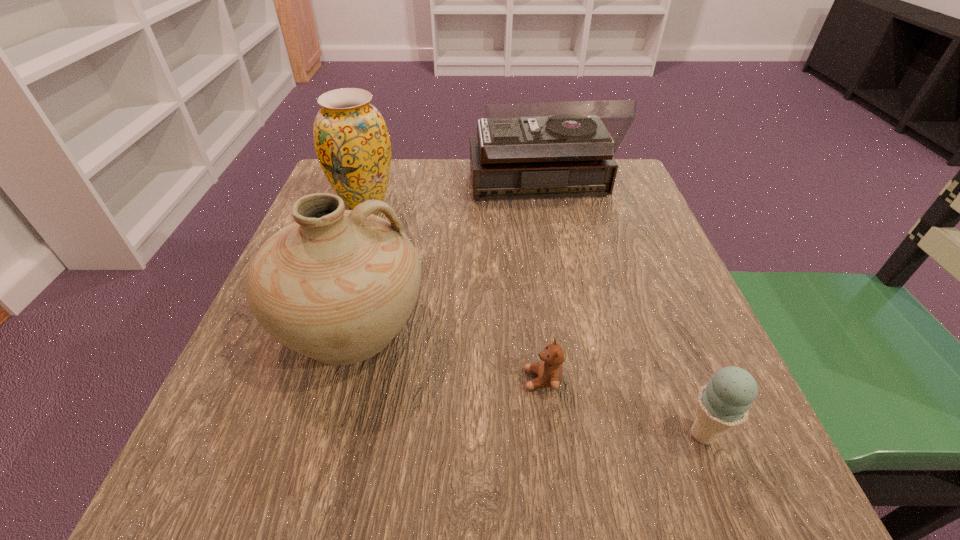
Find the location of `record player`. record player is located at coordinates (531, 149).

At what (x,y) coordinates should I click in order to perform the action: click on pottery. Please return your answer as a coordinate pair (x, y). The image size is (960, 540). Looking at the image, I should click on (336, 285).

At what (x,y) coordinates should I click in order to perform the action: click on vase. Please return your answer as a coordinate pair (x, y). This screenshot has width=960, height=540. Looking at the image, I should click on (351, 140).

Locate an element on the screen. The width and height of the screenshot is (960, 540). the fourth tallest object is located at coordinates (724, 403).

This screenshot has width=960, height=540. What are the coordinates of `the nearest object` in the screenshot? It's located at (724, 403).

The height and width of the screenshot is (540, 960). Find the location of `the shortest object`. the shortest object is located at coordinates (549, 371).

I want to click on free space located on the left of the record player, so click(x=321, y=191).

The image size is (960, 540). Find the location of `vacant space positioned on the back of the pottery`. vacant space positioned on the back of the pottery is located at coordinates (394, 178).

At what (x,y) coordinates should I click in order to perform the action: click on free space located 0.160m on the right of the vase. Please return your answer as a coordinate pair (x, y). Looking at the image, I should click on (467, 201).

The image size is (960, 540). What are the coordinates of `vacant point located 0.140m on the left of the second shortest object` in the screenshot? It's located at tap(579, 434).